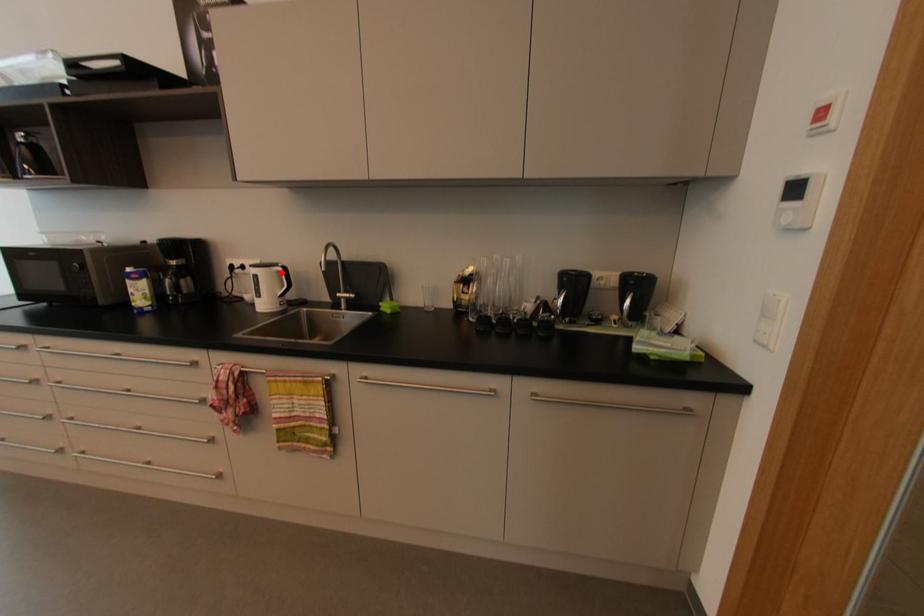
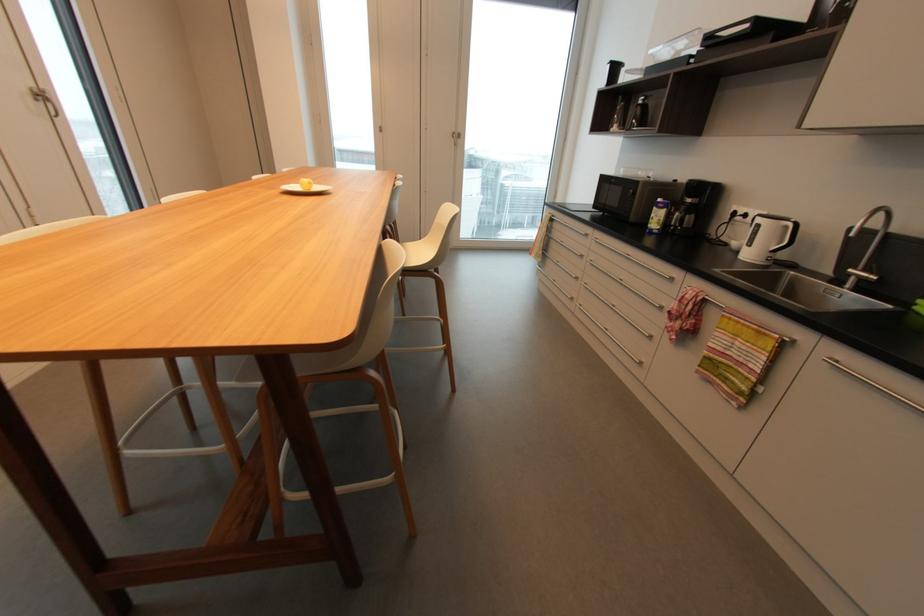
Where in the second image is the point corresponding to the highlighted location from the first image?

(789, 227)